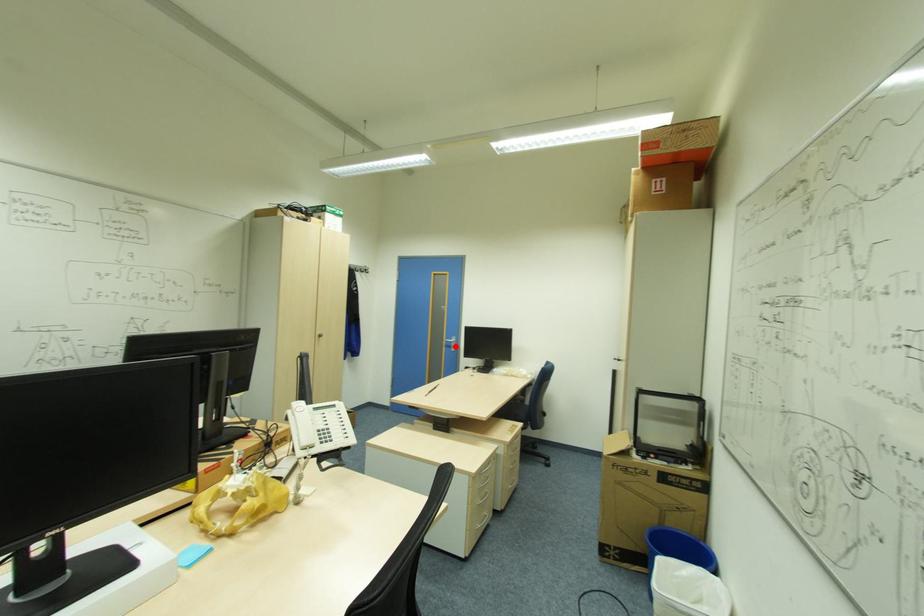
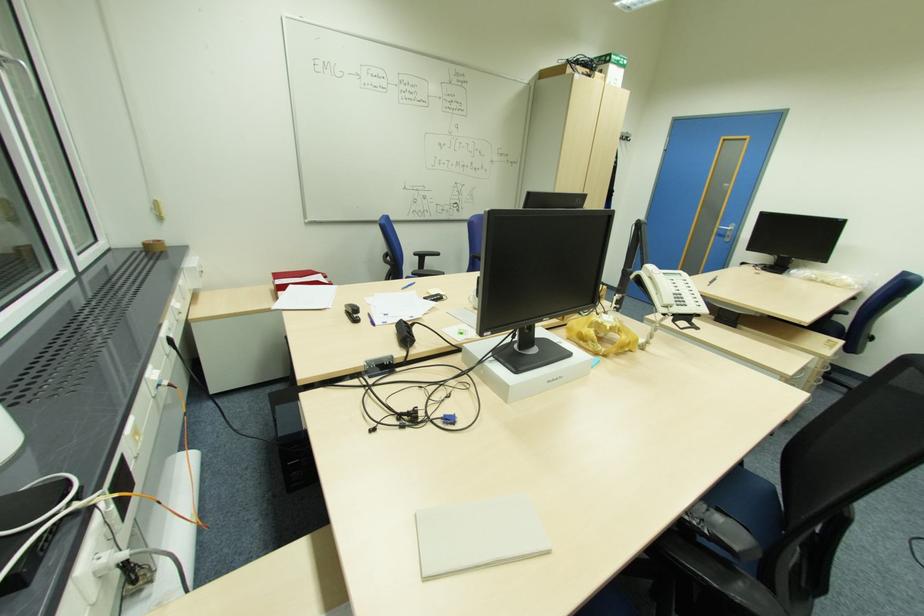
Locate, in the second image, the point that corresponds to the highlighted location in the first image.

(732, 236)